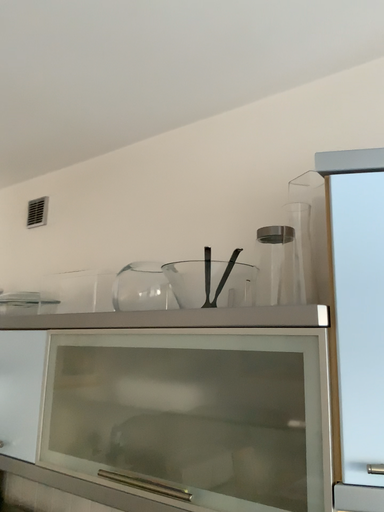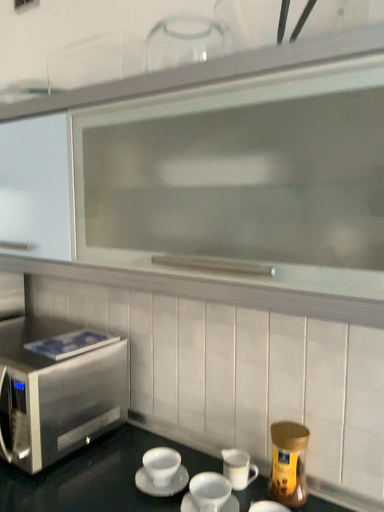
Question: How did the camera likely rotate when shooting the video?

Choices:
 (A) rotated upward
 (B) rotated downward

Answer: (B)